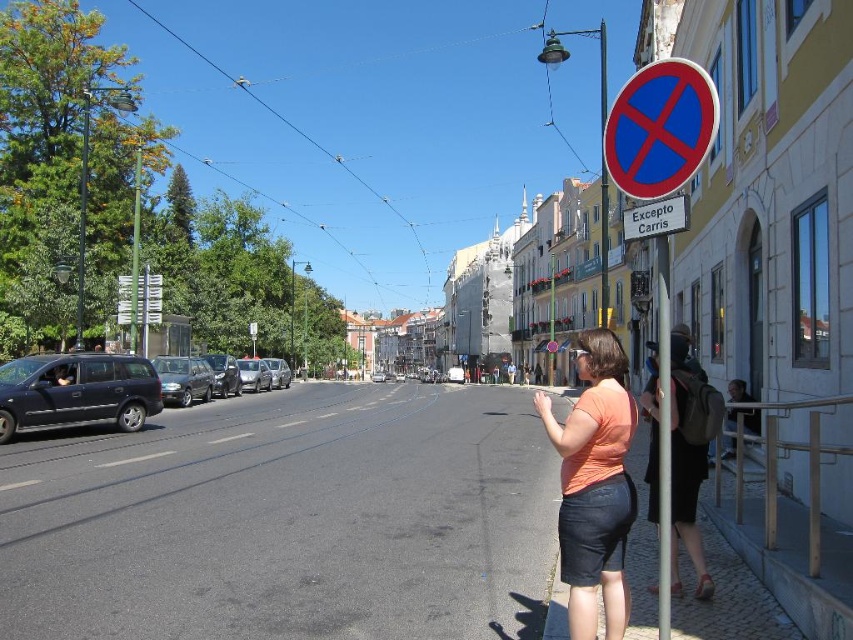
Does silver metallic car at center-left appear over silver metallic car at center?

Correct, silver metallic car at center-left is located above silver metallic car at center.

Is silver metallic car at center-left positioned in front of silver metallic car at center?

Yes.

Between point (260, 369) and point (271, 362), which one is positioned behind?

Positioned behind is point (271, 362).

Find the location of a particular element. silver metallic car at center-left is located at coordinates (253, 374).

Based on the photo, who is lower down, orange cotton shirt at center or silver metallic car at center?

silver metallic car at center is below.

Does orange cotton shirt at center have a larger size compared to silver metallic car at center?

Yes.

At what (x,y) coordinates should I click in order to perform the action: click on orange cotton shirt at center. Please return your answer as a coordinate pair (x, y). Looking at the image, I should click on (595, 484).

Between point (659, 218) and point (218, 365), which one is positioned in front?

Point (659, 218)

Where is `blue plastic sign at upper right`? The width and height of the screenshot is (853, 640). blue plastic sign at upper right is located at coordinates (656, 218).

Identify the location of blue plastic sign at upper right. This screenshot has height=640, width=853. (656, 218).